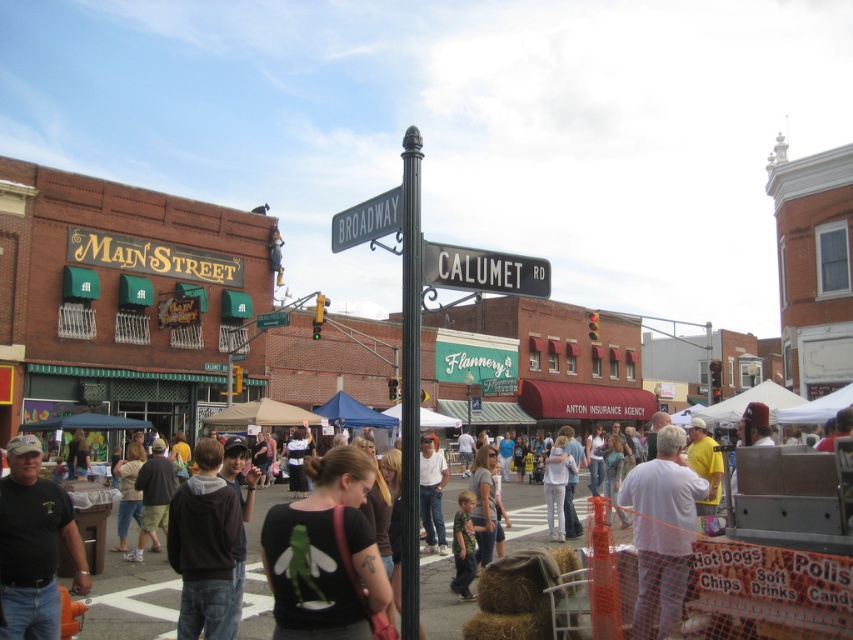
Looking at this image, you are a photographer standing at the intersection of Broadway and Calumet Road. You notice a black matte shirt at center and a white fabric canopy at lower right in your viewfinder. Which object should you zoom in on to capture more details of the smaller one?

The black matte shirt at center is smaller than the white fabric canopy at lower right, so you should zoom in on the black matte shirt at center to capture more details of the smaller one.

You are a photographer standing at the intersection of Broadway and Calumet Road. You notice a white cotton shirt at lower right and a white fabric canopy at lower right in your viewfinder. Which object is taller when viewed from your current position?

The white cotton shirt at lower right is taller than the white fabric canopy at lower right according to the description.

You are a photographer standing at the intersection of Broadway and Calumet Road. You notice a point marked at coordinates (662, 531) in the image. Based on the scene description, can you determine what object this point is located on?

The point at coordinates (662, 531) is located on the white cotton shirt at lower right.